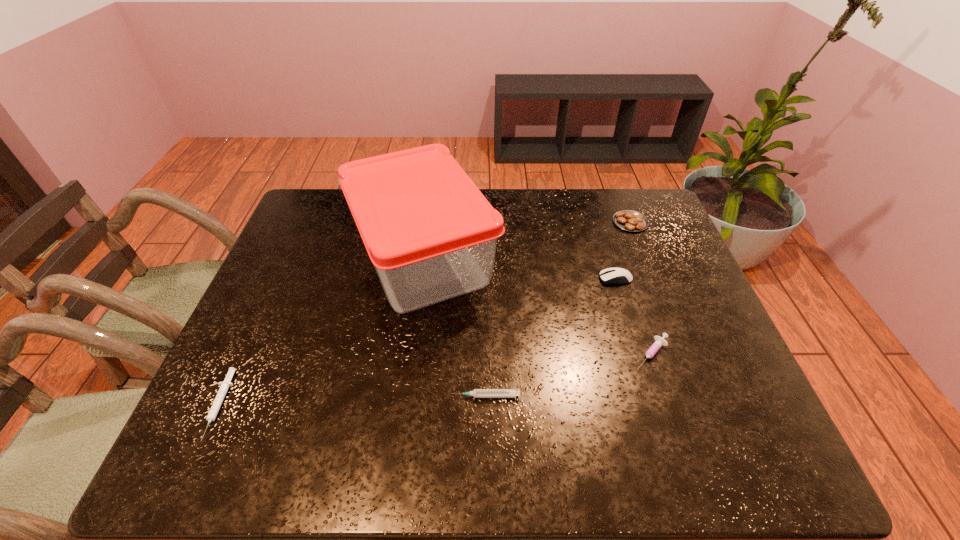
Where is `syringe identified as the second closest to the rightmost syringe`? syringe identified as the second closest to the rightmost syringe is located at coordinates (224, 386).

Locate an element on the screen. The height and width of the screenshot is (540, 960). syringe that is the closest to the tray is located at coordinates (477, 393).

At what (x,y) coordinates should I click in order to perform the action: click on vacant space that satisfies the following two spatial constraints: 1. on the back side of the mouse; 2. on the left side of the pastry. Please return your answer as a coordinate pair (x, y). Looking at the image, I should click on (598, 222).

Locate an element on the screen. The width and height of the screenshot is (960, 540). vacant space that satisfies the following two spatial constraints: 1. on the back side of the rightmost syringe; 2. on the right side of the shortest object is located at coordinates (243, 354).

Locate an element on the screen. free space that satisfies the following two spatial constraints: 1. on the back side of the pastry; 2. on the right side of the shortest object is located at coordinates (302, 222).